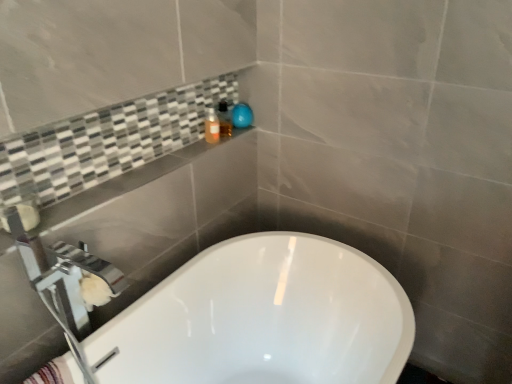
Locate an element on the screen. This screenshot has height=384, width=512. free space in front of translucent plastic soap dispenser at upper center, the first toiletry positioned from the right is located at coordinates (202, 146).